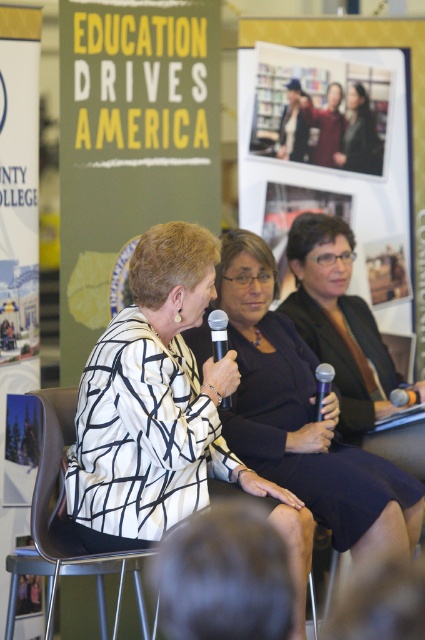
Question: Which of the following is the farthest from the observer?

Choices:
 (A) (218, 330)
 (B) (76, 538)
 (C) (399, 397)
 (D) (356, 129)

Answer: (D)

Question: Which point is farther from the camera taking this photo?

Choices:
 (A) (394, 404)
 (B) (215, 316)

Answer: (A)

Question: Where is black textured dress at center located in relation to white paper poster at left in the image?

Choices:
 (A) left
 (B) right

Answer: (B)

Question: Does white and black patterned jacket at center have a smaller size compared to white paper poster at left?

Choices:
 (A) yes
 (B) no

Answer: (B)

Question: Based on their relative distances, which object is nearer to the black glossy dress at center?

Choices:
 (A) brown plastic chair at center
 (B) white and black patterned jacket at center

Answer: (B)

Question: Can you confirm if matte yellow signboard at center is wider than matte black microphone at center?

Choices:
 (A) yes
 (B) no

Answer: (A)